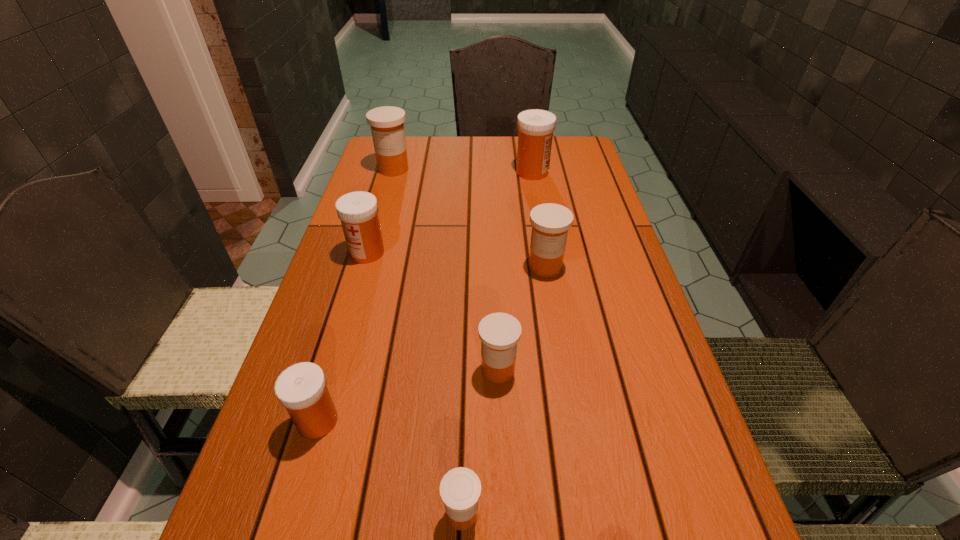
I want to click on unoccupied area between the smallest white medicine and the second smallest white medicine, so click(343, 337).

Where is `vacant space in between the second nearest white medicine and the smallest orange medicine`? The height and width of the screenshot is (540, 960). vacant space in between the second nearest white medicine and the smallest orange medicine is located at coordinates (415, 383).

The width and height of the screenshot is (960, 540). Find the location of `vacant area that lies between the leftmost orange medicine and the second biggest orange medicine`. vacant area that lies between the leftmost orange medicine and the second biggest orange medicine is located at coordinates (469, 218).

Identify the location of free space between the nearest medicine and the leftmost orange medicine. This screenshot has height=540, width=960. (428, 341).

This screenshot has width=960, height=540. Find the location of `unoccupied area between the rightmost white medicine and the third farthest orange medicine`. unoccupied area between the rightmost white medicine and the third farthest orange medicine is located at coordinates (516, 271).

Find the location of `object that is the fifth closest one to the third biggest orange medicine`. object that is the fifth closest one to the third biggest orange medicine is located at coordinates point(535,127).

Point out which object is positioned as the second nearest to the farthest white medicine. Please provide its 2D coordinates. Your answer should be formatted as a tuple, i.e. [(x, y)], where the tuple contains the x and y coordinates of a point satisfying the conditions above.

[(550, 222)]

The width and height of the screenshot is (960, 540). I want to click on medicine that is the third closest one to the second nearest orange medicine, so click(301, 388).

The image size is (960, 540). I want to click on the closest medicine to the fifth farthest object, so click(460, 489).

Identify which white medicine is the second nearest to the second farthest white medicine. Please provide its 2D coordinates. Your answer should be formatted as a tuple, i.e. [(x, y)], where the tuple contains the x and y coordinates of a point satisfying the conditions above.

[(535, 127)]